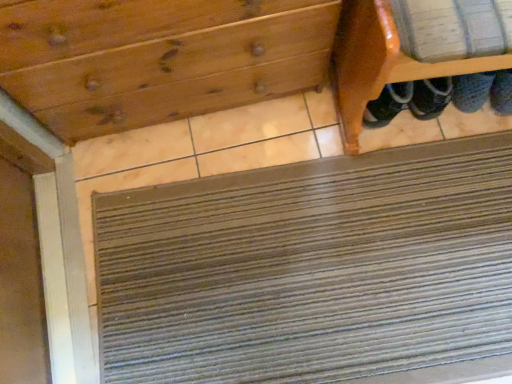
Image resolution: width=512 pixels, height=384 pixels. What are the coordinates of `free space above brown textured mat at lower center (from a real-world perspective)` in the screenshot? It's located at (321, 277).